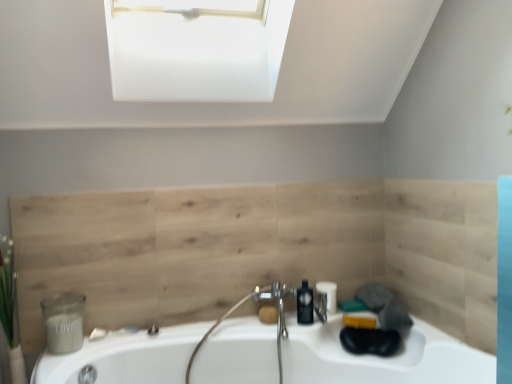
The width and height of the screenshot is (512, 384). Find the location of `white glossy bathtub at center`. white glossy bathtub at center is located at coordinates (333, 356).

In order to face yellow matte soap at center, should I rotate leftwards or rightwards?

To align with it, rotate right about 1.537°.

Image resolution: width=512 pixels, height=384 pixels. In order to click on yellow matte soap at center in this screenshot , I will do `click(268, 314)`.

Identify the location of matte white candle at lower left. (64, 322).

Find the location of a particular element. Image resolution: width=512 pixels, height=384 pixels. natural wood paneling at center is located at coordinates (190, 249).

Is natural wood paneling at center turned away from green leafy plant at left?

No, natural wood paneling at center is not facing the opposite direction of green leafy plant at left.

Between natural wood paneling at center and green leafy plant at left, which one has more height?

natural wood paneling at center.

Is natural wood paneling at center next to green leafy plant at left and touching it?

natural wood paneling at center is not next to green leafy plant at left, and they're not touching.

In the scene shown: Relative to green leafy plant at left, is natural wood paneling at center in front or behind?

Clearly, natural wood paneling at center is behind green leafy plant at left.

Which of these two, white glossy bathtub at center or black plastic soap dispenser at center, stands shorter?

black plastic soap dispenser at center.

Are white glossy bathtub at center and black plastic soap dispenser at center far apart?

No, there isn't a large distance between white glossy bathtub at center and black plastic soap dispenser at center.

Identify the location of soap dispenser located on the right of white glossy bathtub at center. This screenshot has width=512, height=384. (305, 304).

Would you say white glossy bathtub at center contains black plastic soap dispenser at center?

Yes, black plastic soap dispenser at center is inside white glossy bathtub at center.

Considering the relative positions of white glossy bathtub at center and yellow matte soap at center in the image provided, is white glossy bathtub at center in front of yellow matte soap at center?

Yes, it is.

Is white glossy bathtub at center smaller than yellow matte soap at center?

No.

How much distance is there between white glossy bathtub at center and yellow matte soap at center?

white glossy bathtub at center and yellow matte soap at center are 17.06 inches apart.

Considering the sizes of white glossy bathtub at center and yellow matte soap at center in the image, is white glossy bathtub at center wider or thinner than yellow matte soap at center?

Clearly, white glossy bathtub at center has more width compared to yellow matte soap at center.

How different are the orientations of matte white candle at lower left and white glossy bathtub at center in degrees?

4.48 degrees separate the facing orientations of matte white candle at lower left and white glossy bathtub at center.

From a real-world perspective, is matte white candle at lower left positioned under white glossy bathtub at center based on gravity?

No, from a real-world perspective, matte white candle at lower left is not below white glossy bathtub at center.

Considering the relative positions of matte white candle at lower left and white glossy bathtub at center in the image provided, is matte white candle at lower left in front of white glossy bathtub at center?

No, it is behind white glossy bathtub at center.

Who is taller, matte white candle at lower left or white glossy bathtub at center?

white glossy bathtub at center.

At what (x,y) coordinates should I click in order to perform the action: click on plywood above the black plastic soap dispenser at center (from a real-world perspective). Please return your answer as a coordinate pair (x, y). The image size is (512, 384). Looking at the image, I should click on (190, 249).

Considering the sizes of objects black plastic soap dispenser at center and natural wood paneling at center in the image provided, who is wider, black plastic soap dispenser at center or natural wood paneling at center?

With larger width is black plastic soap dispenser at center.

Which is less distant, (312, 317) or (382, 258)?

The point (312, 317) is closer to the camera.

How far apart are black plastic soap dispenser at center and natural wood paneling at center?

They are 22.89 inches apart.

From the image's perspective, between matte white candle at lower left and black plastic soap dispenser at center, which one is located above?

From the image's view, black plastic soap dispenser at center is above.

Is matte white candle at lower left wider or thinner than black plastic soap dispenser at center?

matte white candle at lower left is wider than black plastic soap dispenser at center.

Measure the distance between matte white candle at lower left and black plastic soap dispenser at center.

matte white candle at lower left is 1.08 meters away from black plastic soap dispenser at center.

Which of these two, matte white candle at lower left or black plastic soap dispenser at center, stands shorter?

With less height is matte white candle at lower left.

Which point is more forward, (269, 319) or (150, 382)?

The point (150, 382) is closer to the camera.

Is yellow matte soap at center next to white glossy bathtub at center?

No, yellow matte soap at center is not in contact with white glossy bathtub at center.

Consider the image. Can you confirm if yellow matte soap at center is shorter than white glossy bathtub at center?

Yes, yellow matte soap at center is shorter than white glossy bathtub at center.

I want to click on plant on the left of natural wood paneling at center, so click(x=10, y=310).

I want to click on bathtub below the black plastic soap dispenser at center (from the image's perspective), so click(333, 356).

Estimate the real-world distances between objects in this image. Which object is further from yellow matte soap at center, white glossy bathtub at center or green leafy plant at left?

Among the two, green leafy plant at left is located further to yellow matte soap at center.

Which object lies further to the anchor point matte white candle at lower left, natural wood paneling at center or green leafy plant at left?

natural wood paneling at center is positioned further to the anchor matte white candle at lower left.

Which object lies further to the anchor point white glossy bathtub at center, black plastic soap dispenser at center or matte white candle at lower left?

matte white candle at lower left is positioned further to the anchor white glossy bathtub at center.

From the image, which object appears to be nearer to green leafy plant at left, black plastic soap dispenser at center or natural wood paneling at center?

natural wood paneling at center.

Considering their positions, is yellow matte soap at center positioned closer to matte white candle at lower left than white glossy bathtub at center?

white glossy bathtub at center lies closer to matte white candle at lower left than the other object.

Which object lies nearer to the anchor point natural wood paneling at center, black plastic soap dispenser at center or white glossy bathtub at center?

white glossy bathtub at center.

Based on their spatial positions, is matte white candle at lower left or yellow matte soap at center further from green leafy plant at left?

Based on the image, yellow matte soap at center appears to be further to green leafy plant at left.

Looking at the image, which one is located closer to yellow matte soap at center, white glossy bathtub at center or natural wood paneling at center?

Among the two, white glossy bathtub at center is located nearer to yellow matte soap at center.

At what (x,y) coordinates should I click in order to perform the action: click on toiletry between green leafy plant at left and yellow matte soap at center from left to right. Please return your answer as a coordinate pair (x, y). Image resolution: width=512 pixels, height=384 pixels. Looking at the image, I should click on (64, 322).

Find the location of a particular element. The image size is (512, 384). plywood located between green leafy plant at left and white glossy bathtub at center in the left-right direction is located at coordinates (190, 249).

This screenshot has height=384, width=512. I want to click on plywood between matte white candle at lower left and black plastic soap dispenser at center in the horizontal direction, so click(190, 249).

Identify the location of plywood located between white glossy bathtub at center and yellow matte soap at center in the depth direction. (190, 249).